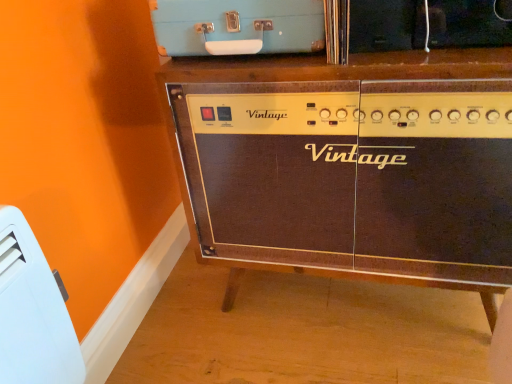
Question: Which is correct: light blue plastic suitcase at upper center, arranged as the first appliance when viewed from the right, is inside white plastic heater at lower left, placed as the 1th appliance when sorted from bottom to top, or outside of it?

Choices:
 (A) inside
 (B) outside

Answer: (B)

Question: Considering the positions of light blue plastic suitcase at upper center, which is counted as the 1th appliance, starting from the top, and white plastic heater at lower left, placed as the 1th appliance when sorted from bottom to top, in the image, is light blue plastic suitcase at upper center, which is counted as the 1th appliance, starting from the top, wider or thinner than white plastic heater at lower left, placed as the 1th appliance when sorted from bottom to top,?

Choices:
 (A) wide
 (B) thin

Answer: (A)

Question: Which is nearer to the brown wood cabinet at center?

Choices:
 (A) white plastic heater at lower left, placed as the 1th appliance when sorted from bottom to top
 (B) light blue plastic suitcase at upper center, which ranks as the second appliance in bottom-to-top order

Answer: (B)

Question: Estimate the real-world distances between objects in this image. Which object is closer to the brown wood cabinet at center?

Choices:
 (A) light blue plastic suitcase at upper center, which is counted as the 1th appliance, starting from the top
 (B) white plastic heater at lower left, placed as the 1th appliance when sorted from bottom to top

Answer: (A)